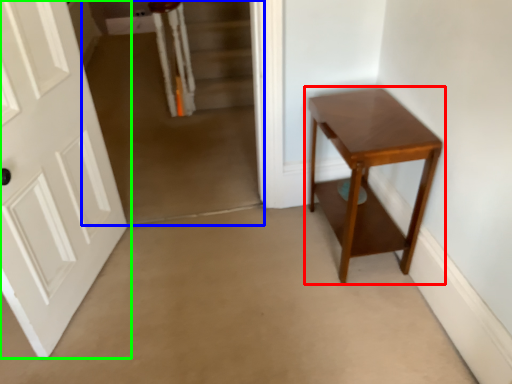
Question: Which is nearer to the table (highlighted by a red box)? corridor (highlighted by a blue box) or door (highlighted by a green box).

Choices:
 (A) corridor
 (B) door

Answer: (A)